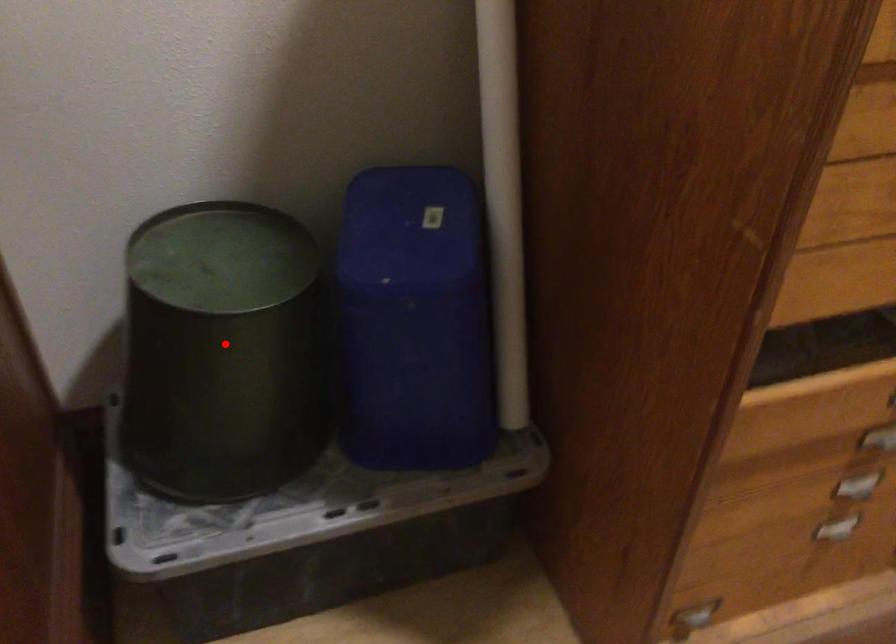
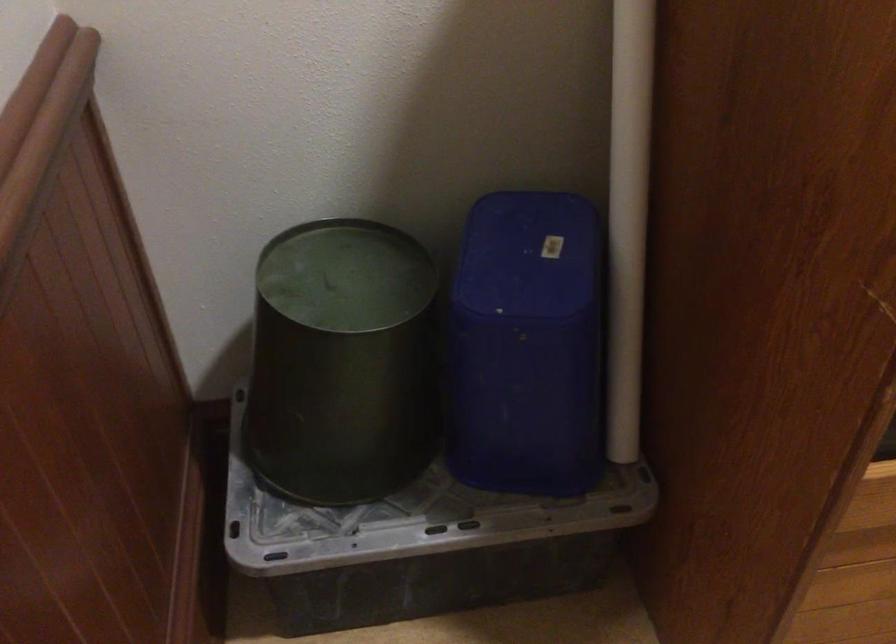
Find the pixel in the second image that matches the highlighted location in the first image.

(342, 362)